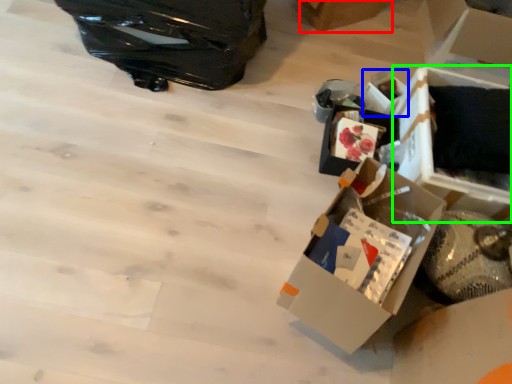
Question: Based on their relative distances, which object is farther from cardboard box (highlighted by a red box)? Choose from storage box (highlighted by a blue box) and storage box (highlighted by a green box).

Choices:
 (A) storage box
 (B) storage box

Answer: (B)